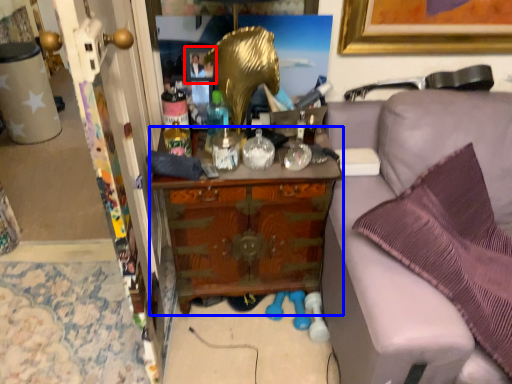
Question: Which object appears farthest to the camera in this image, picture frame (highlighted by a red box) or cabinetry (highlighted by a blue box)?

Choices:
 (A) picture frame
 (B) cabinetry

Answer: (A)